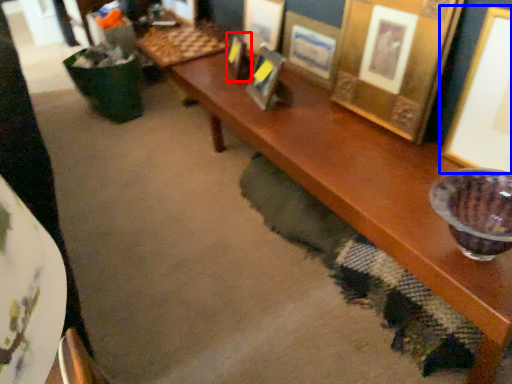
Question: Which point is further to the camera, picture frame (highlighted by a red box) or picture frame (highlighted by a blue box)?

Choices:
 (A) picture frame
 (B) picture frame

Answer: (A)